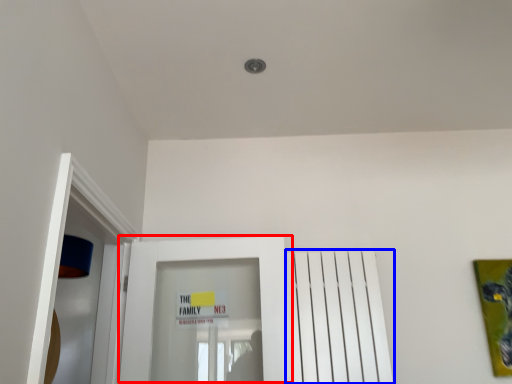
Question: Which object is further to the camera taking this photo, door (highlighted by a red box) or radiator (highlighted by a blue box)?

Choices:
 (A) door
 (B) radiator

Answer: (B)